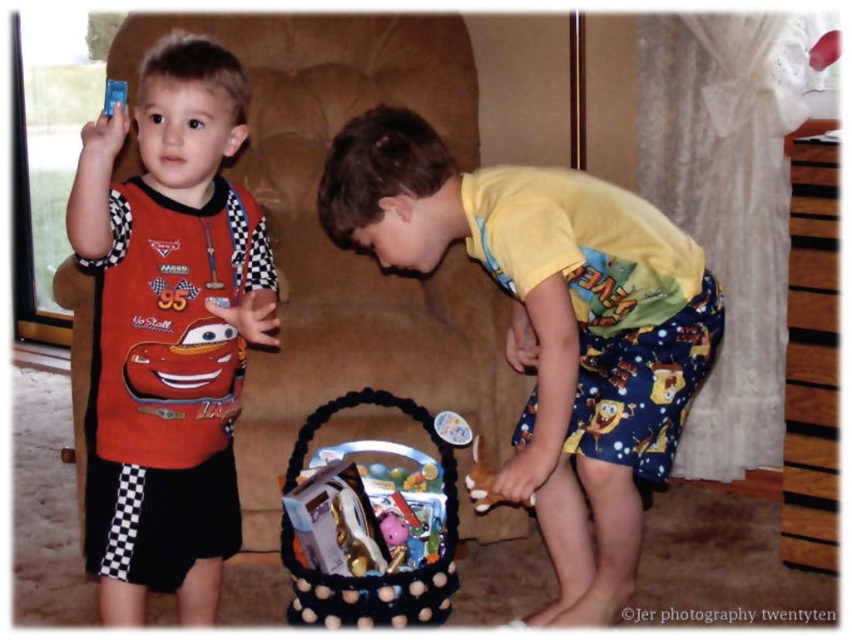
Does point (622, 509) come behind point (107, 88)?

Yes, it is behind point (107, 88).

Is point (613, 563) in front of point (106, 100)?

No, it is not.

Is point (597, 534) farther from camera compared to point (107, 83)?

Yes.

Locate an element on the screen. yellow cotton shirt at center is located at coordinates (551, 326).

Which of these two, yellow cotton shirt at center or matte plastic toy car at left, stands shorter?

With less height is yellow cotton shirt at center.

Which is behind, point (677, 289) or point (89, 385)?

The point (89, 385) is more distant.

At what (x,y) coordinates should I click in order to perform the action: click on yellow cotton shirt at center. Please return your answer as a coordinate pair (x, y). Looking at the image, I should click on pyautogui.click(x=551, y=326).

Between black woven basket at lower center and brown wooden toy at lower center, which one is positioned higher?

Positioned higher is brown wooden toy at lower center.

Which is more to the right, black woven basket at lower center or brown wooden toy at lower center?

Positioned to the right is brown wooden toy at lower center.

This screenshot has height=640, width=852. I want to click on black woven basket at lower center, so click(x=370, y=577).